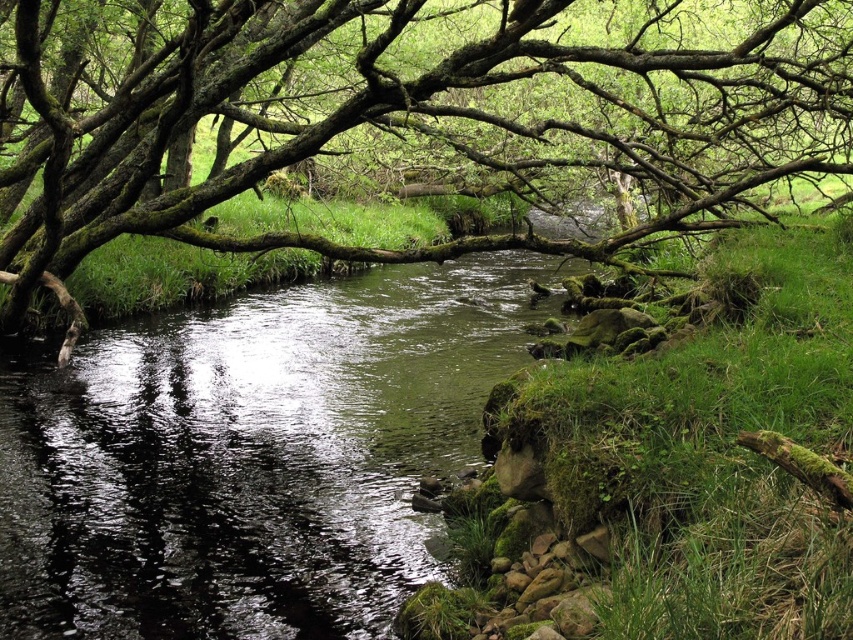
You are a hiker carrying a 5.00 meter long wooden plank. You want to cross the stream using the green mossy branches at upper center and the green mossy water at center as support points. Will your plank be long enough to span the gap between them?

The green mossy branches at upper center and green mossy water at center are 5.20 meters apart. Since the plank is only 5.00 meters long, it will be 0.20 meters too short to span the gap between them.

You are standing at the origin point of the scene and want to locate the green mossy branches at upper center. What are their coordinates in the scene?

The green mossy branches at upper center are located at coordinates point (413, 113).

You are a hiker trying to cross the stream using the green mossy branches at upper center as a bridge. The branches are wider than the green mossy water at center. Can you safely step on the branches to cross?

The green mossy branches at upper center are wider than the green mossy water at center, so they should provide a stable surface for crossing. However, caution is advised due to the mossy surface which may be slippery.